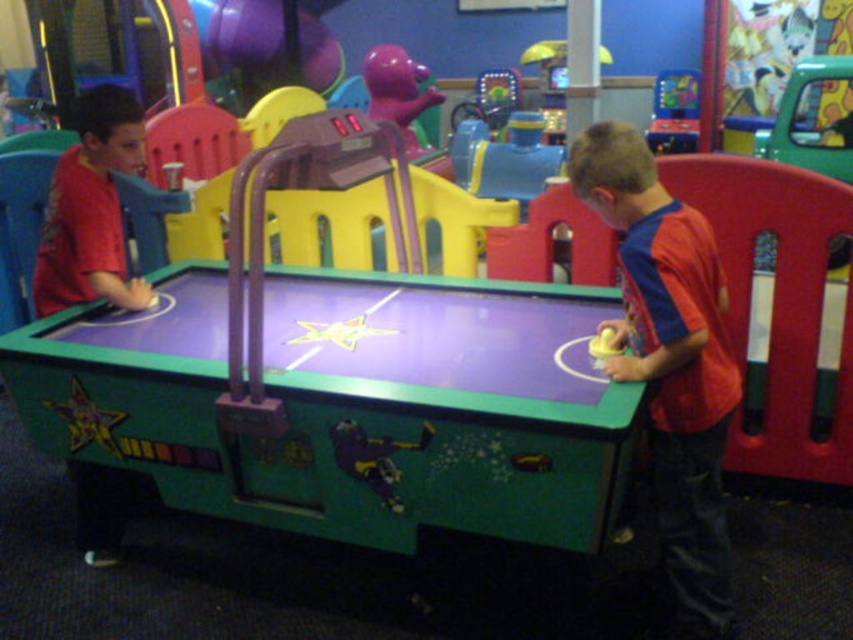
In the scene shown: Can you confirm if matte red shirt at right is shorter than metallic blue arcade machine at upper right?

No.

Which is behind, point (633, 272) or point (676, 99)?

Point (676, 99)

Describe the element at coordinates (670, 364) in the screenshot. This screenshot has height=640, width=853. I see `matte red shirt at right` at that location.

You are a GUI agent. You are given a task and a screenshot of the screen. Output one action in this format:
    pyautogui.click(x=<x>, y=<y>)
    Task: Click on the matte red shirt at right
    The image size is (853, 640).
    Given the screenshot: What is the action you would take?
    pyautogui.click(x=670, y=364)

Is point (416, 93) positioned before point (670, 138)?

Yes.

Is purple matte bear at upper center thinner than metallic blue arcade machine at upper right?

Incorrect, purple matte bear at upper center's width is not less than metallic blue arcade machine at upper right's.

Does point (419, 115) come closer to viewer compared to point (666, 76)?

Yes, point (419, 115) is in front of point (666, 76).

Where is `purple matte bear at upper center`? The height and width of the screenshot is (640, 853). purple matte bear at upper center is located at coordinates (398, 92).

Which is above, matte red shirt at right or purple matte bear at upper center?

Positioned higher is purple matte bear at upper center.

Does point (695, 561) come closer to viewer compared to point (397, 48)?

Yes.

Find the location of a particular element. matte red shirt at right is located at coordinates (670, 364).